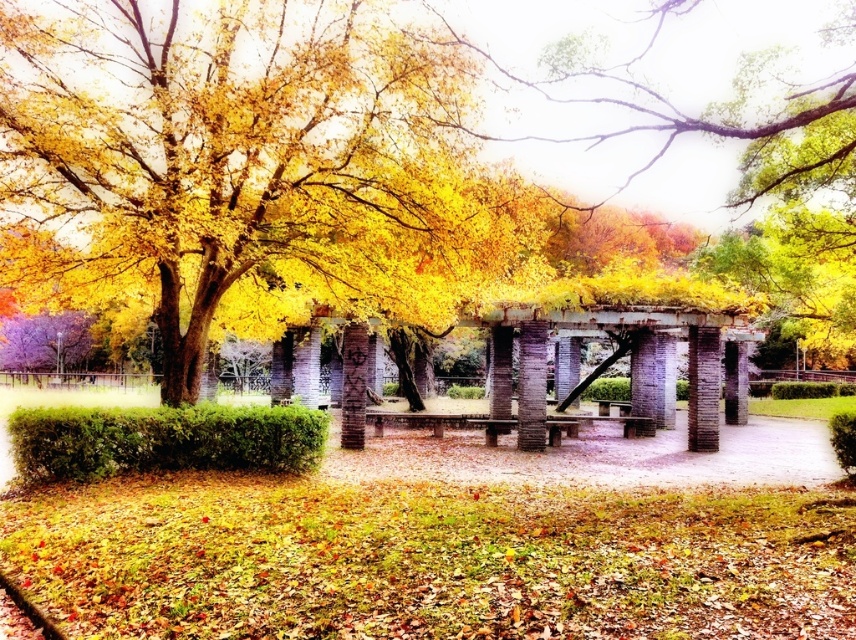
Question: Does rustic stone pillar at center appear on the right side of brick textured pillar at center?

Choices:
 (A) yes
 (B) no

Answer: (A)

Question: Which of the following is the closest to the observer?

Choices:
 (A) rustic stone pillar at center
 (B) green leafy hedge at lower left
 (C) yellow leaves at center
 (D) brick textured pillar at center

Answer: (C)

Question: Which is farther from the brick textured pillar at center?

Choices:
 (A) green leafy hedge at lower left
 (B) yellow leaves at center

Answer: (B)

Question: Is yellow leaves at center in front of green leafy hedge at lower left?

Choices:
 (A) yes
 (B) no

Answer: (A)

Question: Can you confirm if yellow leaves at center is thinner than rustic stone pillar at center?

Choices:
 (A) yes
 (B) no

Answer: (B)

Question: Among these objects, which one is farthest from the camera?

Choices:
 (A) gray stone column at center
 (B) brick textured pillar at center

Answer: (A)